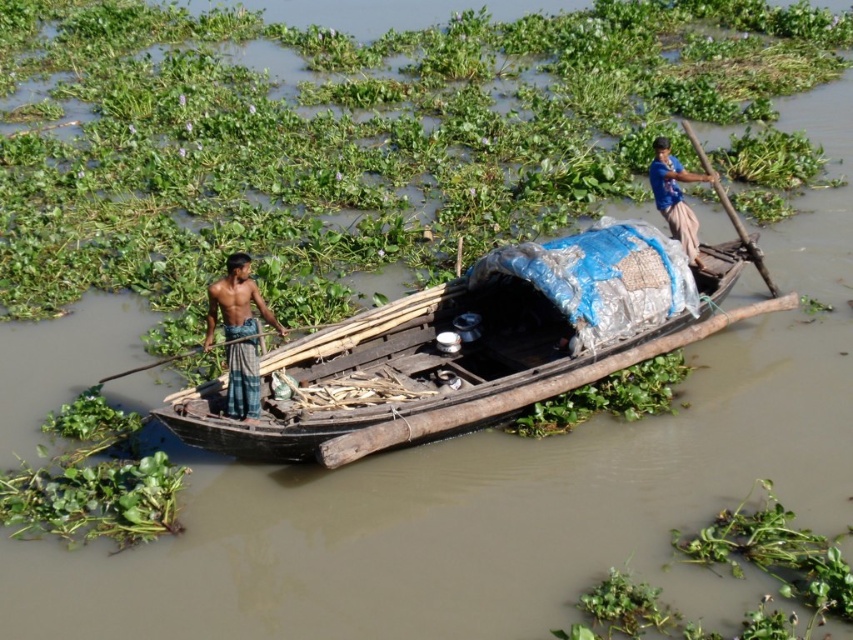
You are standing on the bank of the waterway and want to determine which of the two points, point (247,358) or point (107,376), is closer to you. Based on the image, which point is nearer?

Point (247,358) is closer to the viewer than point (107,376).

You are a passenger on the wooden boat at center and need to move to the shiny blue shirt at left. Is there enough space to move freely between them?

The wooden boat at center might be wider than shiny blue shirt at left, so there might be enough space to move freely between them.

You are a passenger on the boat and need to store your belongings. You have a shiny blue shirt at left and a wooden paddle at left. Which item requires more space horizontally to store properly?

The shiny blue shirt at left requires more horizontal space because its width is larger than that of the wooden paddle at left.